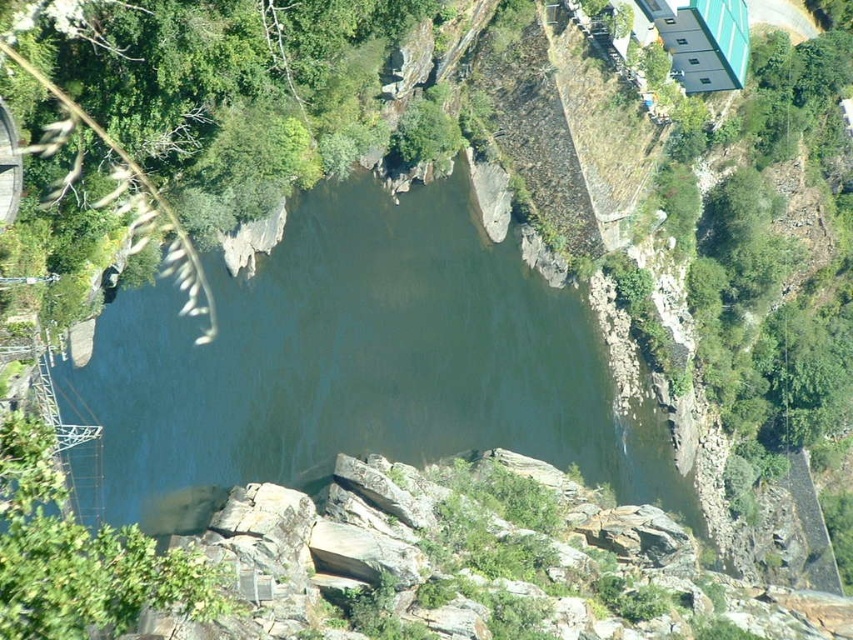
Question: In this image, where is greenish-gray water at center located relative to green leafy vegetation at upper left?

Choices:
 (A) left
 (B) right

Answer: (B)

Question: Does greenish-gray water at center appear on the right side of green leafy vegetation at upper left?

Choices:
 (A) yes
 (B) no

Answer: (A)

Question: Does greenish-gray water at center have a greater width compared to green leafy vegetation at upper left?

Choices:
 (A) yes
 (B) no

Answer: (A)

Question: Which point is closer to the camera taking this photo?

Choices:
 (A) (372, 276)
 (B) (369, 120)

Answer: (B)